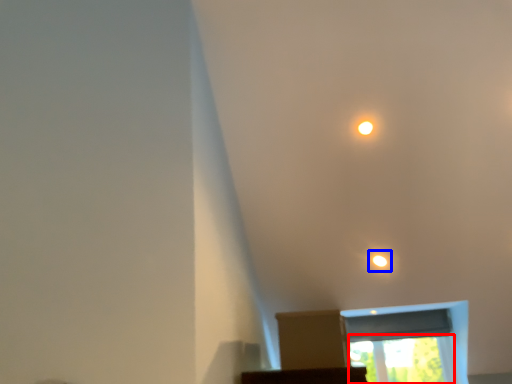
Question: Which object appears closest to the camera in this image, window screen (highlighted by a red box) or light (highlighted by a blue box)?

Choices:
 (A) window screen
 (B) light

Answer: (B)